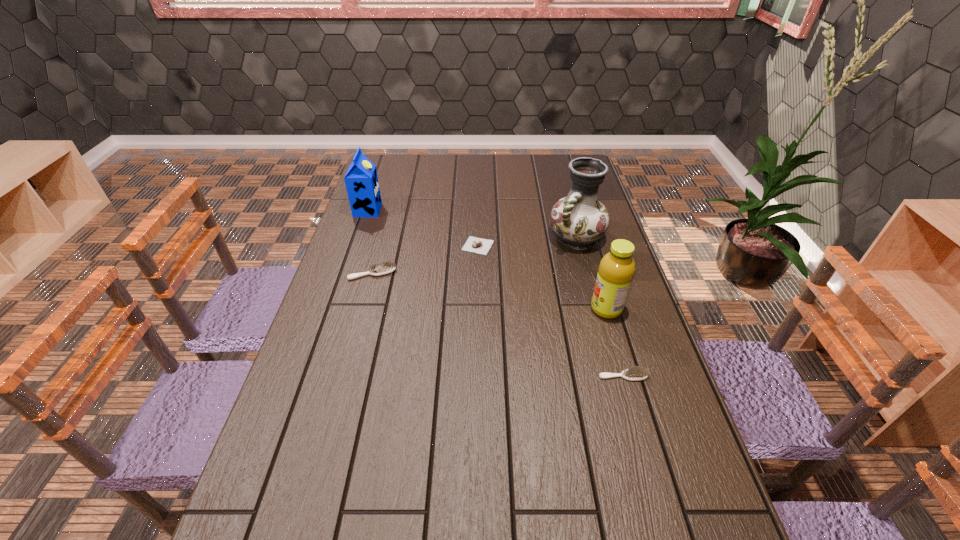
You are a GUI agent. You are given a task and a screenshot of the screen. Output one action in this format:
    pyautogui.click(x=<x>, y=<y>)
    Task: Click on the fourth farthest object
    This screenshot has height=540, width=960.
    Given the screenshot: What is the action you would take?
    pyautogui.click(x=388, y=267)

This screenshot has height=540, width=960. In order to click on the farther scrubbing brush in this screenshot , I will do `click(388, 267)`.

The image size is (960, 540). I want to click on the shorter scrubbing brush, so click(635, 373).

Identify the location of the nearer scrubbing brush. This screenshot has width=960, height=540. (635, 373).

Find the location of a particular element. This screenshot has width=960, height=540. fruit juice is located at coordinates (616, 270).

Where is `the tallest object`? the tallest object is located at coordinates (578, 220).

What are the coordinates of `carton` in the screenshot? It's located at (361, 180).

Locate an element on the screen. This screenshot has width=960, height=540. the fourth object from right to left is located at coordinates click(x=473, y=244).

Find the location of `free space located on the right of the third nearest object`. free space located on the right of the third nearest object is located at coordinates (450, 273).

Identify the location of vacant space located on the front of the nearer scrubbing brush. (662, 512).